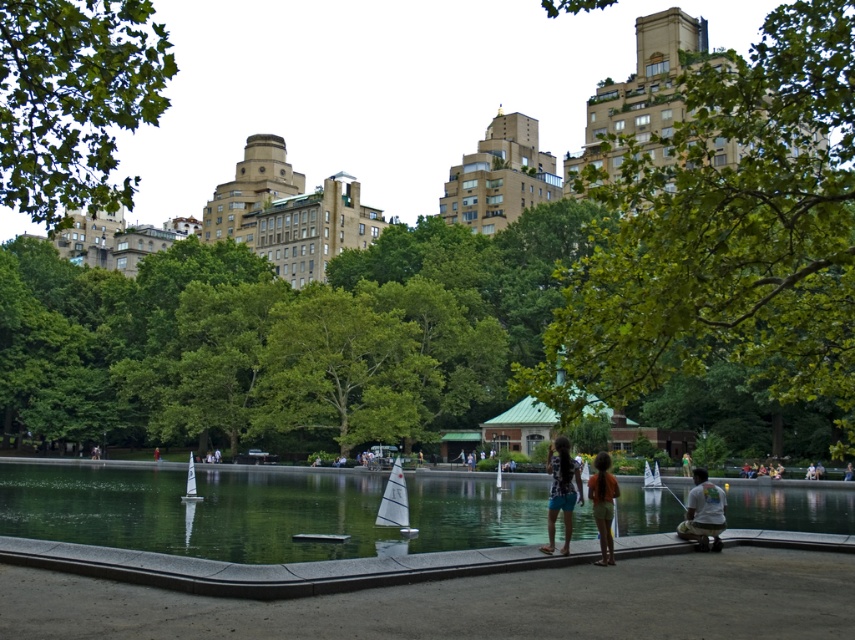
Question: Which of these objects is positioned closest to the clear water at center?

Choices:
 (A) green leafy tree at upper center
 (B) matte black dress at center
 (C) white cotton shirt at lower right

Answer: (B)

Question: Which object is farther from the camera taking this photo?

Choices:
 (A) green leafy tree at center
 (B) matte black swimsuit at center
 (C) clear water at center

Answer: (A)

Question: Which is nearer to the white cotton shirt at lower right?

Choices:
 (A) green leafy tree at center
 (B) clear water at center
 (C) green leafy tree at upper left
 (D) green leafy tree at upper center

Answer: (D)

Question: Can you confirm if green leafy tree at upper left is thinner than white cotton shirt at lower right?

Choices:
 (A) yes
 (B) no

Answer: (B)

Question: Does white cotton shirt at lower right have a greater width compared to green fabric dress at lower center?

Choices:
 (A) no
 (B) yes

Answer: (B)

Question: Does matte black dress at center lie behind white cotton shirt at lower right?

Choices:
 (A) no
 (B) yes

Answer: (A)